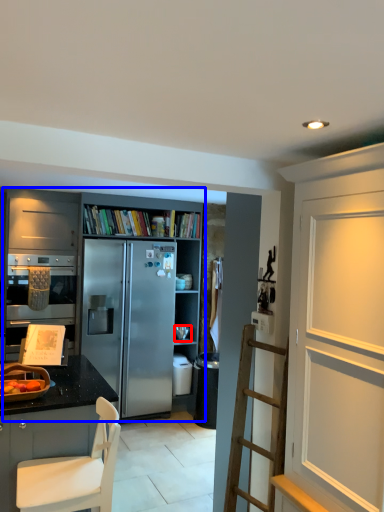
Question: Which point is closer to the camera, appliance (highlighted by a red box) or cabinetry (highlighted by a blue box)?

Choices:
 (A) appliance
 (B) cabinetry

Answer: (B)